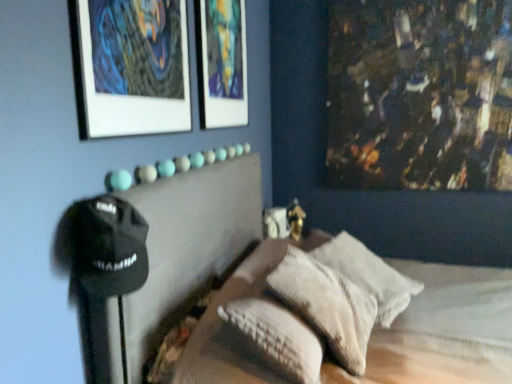
Question: Which direction should I rotate to face matte glass picture frame at upper center, the first picture frame positioned from the back, — up or down?

Choices:
 (A) down
 (B) up

Answer: (B)

Question: Should I look upward or downward to see matte white picture frame at upper left, arranged as the 1th picture frame when viewed from the left?

Choices:
 (A) down
 (B) up

Answer: (B)

Question: Could you tell me if matte glass picture frame at upper center, the 2th picture frame from the front, is facing textured beige pillow at center, the second pillow positioned from the back?

Choices:
 (A) yes
 (B) no

Answer: (B)

Question: From the image's perspective, is matte glass picture frame at upper center, the first picture frame positioned from the back, below textured beige pillow at center, the second pillow positioned from the back?

Choices:
 (A) yes
 (B) no

Answer: (B)

Question: Is textured beige pillow at center, the 1th pillow in the front-to-back sequence, a part of matte glass picture frame at upper center, the 2th picture frame from the front?

Choices:
 (A) no
 (B) yes

Answer: (A)

Question: Considering the relative positions of matte glass picture frame at upper center, acting as the first picture frame starting from the right, and textured beige pillow at center, the second pillow positioned from the back, in the image provided, is matte glass picture frame at upper center, acting as the first picture frame starting from the right, to the right of textured beige pillow at center, the second pillow positioned from the back, from the viewer's perspective?

Choices:
 (A) yes
 (B) no

Answer: (B)

Question: Is matte glass picture frame at upper center, the 2th picture frame when ordered from left to right, not inside textured beige pillow at center, the second pillow positioned from the back?

Choices:
 (A) no
 (B) yes

Answer: (B)

Question: From the image's perspective, is matte glass picture frame at upper center, the 2th picture frame when ordered from left to right, over textured beige pillow at center, the second pillow positioned from the back?

Choices:
 (A) no
 (B) yes

Answer: (B)

Question: Can white textured pillow at center, which appears as the 1th pillow when viewed from the back, be found inside textured beige pillow at center, the 1th pillow in the front-to-back sequence?

Choices:
 (A) no
 (B) yes

Answer: (A)

Question: Is textured beige pillow at center, the 1th pillow in the front-to-back sequence, next to white textured pillow at center, which appears as the 1th pillow when viewed from the back?

Choices:
 (A) no
 (B) yes

Answer: (A)

Question: From the image's perspective, is textured beige pillow at center, the 1th pillow in the front-to-back sequence, above white textured pillow at center, the second pillow in the front-to-back sequence?

Choices:
 (A) yes
 (B) no

Answer: (B)

Question: From the image's perspective, is textured beige pillow at center, the 1th pillow in the front-to-back sequence, located beneath white textured pillow at center, which appears as the 1th pillow when viewed from the back?

Choices:
 (A) yes
 (B) no

Answer: (A)

Question: Does textured beige pillow at center, the 1th pillow in the front-to-back sequence, appear on the left side of white textured pillow at center, which appears as the 1th pillow when viewed from the back?

Choices:
 (A) yes
 (B) no

Answer: (A)

Question: From a real-world perspective, is textured beige pillow at center, the second pillow positioned from the back, over white textured pillow at center, the second pillow in the front-to-back sequence?

Choices:
 (A) no
 (B) yes

Answer: (B)

Question: Can you confirm if textured beige pillow at center, the 1th pillow in the front-to-back sequence, is shorter than matte glass picture frame at upper center, the 2th picture frame from the front?

Choices:
 (A) yes
 (B) no

Answer: (A)